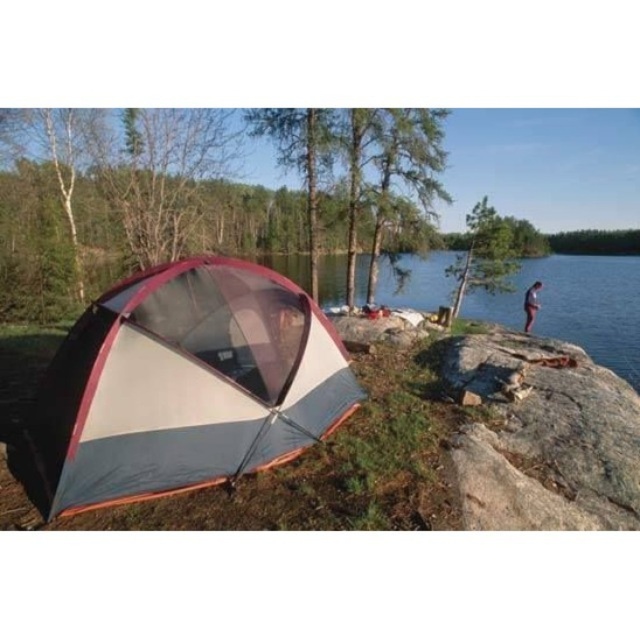
You are a hiker who wants to place a small backpack between the gray rough rock at right and the light blue jeans at right. Based on the scene, can you determine which object you should place the backpack closer to in order to be closer to the viewer?

The gray rough rock at right is closer to the viewer than the light blue jeans at right, so placing the backpack closer to the gray rough rock at right would make it closer to the viewer.

You are a drone operator trying to capture aerial footage of the camping scene. You need to fly your drone from the camera position to a specific point. Which of the two points, point [227,416] or point [524,320], requires the drone to ascend higher to reach its destination?

Point [524,320] requires the drone to ascend higher because it is farther from the camera compared to point [227,416], which is closer.

You are a hiker trying to set up a tent. You have a map showing the multicolored fabric tent at left and light blue jeans at right in the camping area. According to the map, which object is nearer to your current position if you are standing at the center of the scene?

The multicolored fabric tent at left is closer to the viewer than the light blue jeans at right, so the tent would be nearer to your current position.